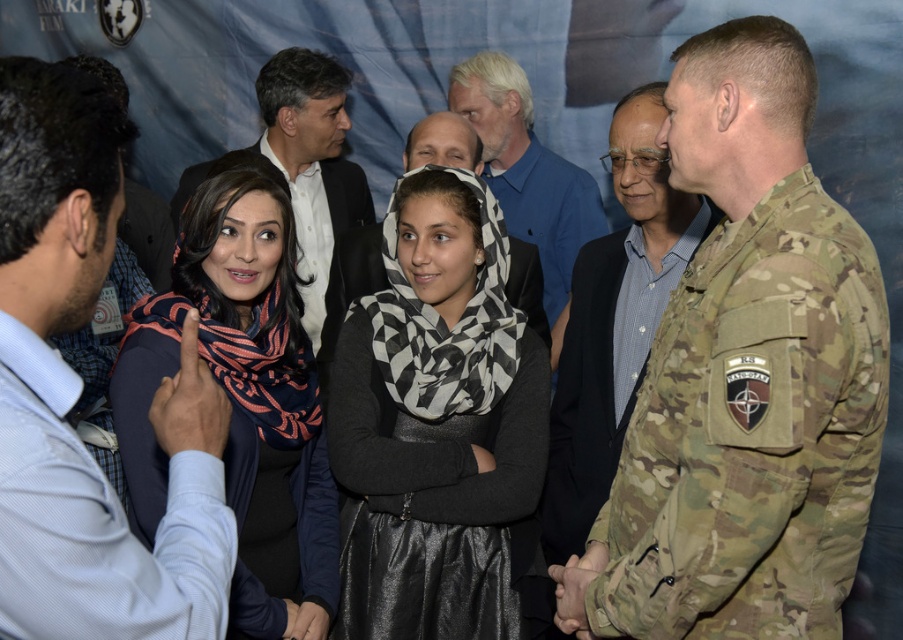
Who is taller, light blue shirt at left or camouflage uniform at right?

camouflage uniform at right

Find the location of a particular element. light blue shirt at left is located at coordinates (80, 388).

Is light blue shirt at left below light blue shirt at center?

Indeed, light blue shirt at left is positioned under light blue shirt at center.

Can you confirm if light blue shirt at left is smaller than light blue shirt at center?

Actually, light blue shirt at left might be larger than light blue shirt at center.

Which is behind, point (188, 522) or point (375, 276)?

The point (375, 276) is behind.

I want to click on light blue shirt at left, so click(80, 388).

Is point (661, 586) in front of point (411, 513)?

Yes, it is.

Does camouflage fabric military uniform at right have a lesser height compared to black and white checkered scarf at center?

Yes, camouflage fabric military uniform at right is shorter than black and white checkered scarf at center.

You are a GUI agent. You are given a task and a screenshot of the screen. Output one action in this format:
    pyautogui.click(x=<x>, y=<y>)
    Task: Click on the camouflage fabric military uniform at right
    
    Given the screenshot: What is the action you would take?
    pyautogui.click(x=751, y=433)

The height and width of the screenshot is (640, 903). Identify the location of camouflage fabric military uniform at right. (751, 433).